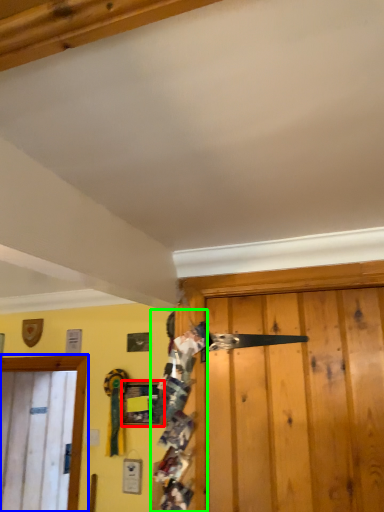
Question: Which object is positioned closest to picture frame (highlighted by a red box)? Select from door (highlighted by a blue box) and person (highlighted by a green box).

Choices:
 (A) door
 (B) person

Answer: (A)